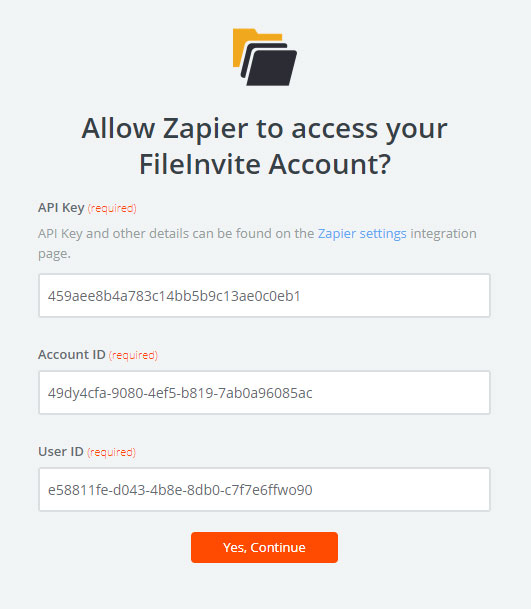
The image size is (531, 609). In order to click on black file folders in this screenshot , I will do `click(272, 58)`, `click(246, 53)`.